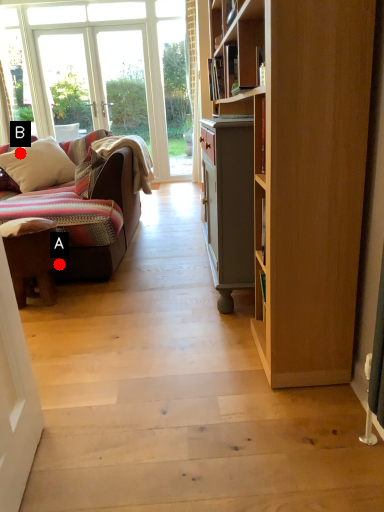
Question: Two points are circled on the image, labeled by A and B beside each circle. Which point appears farthest from the camera in this image?

Choices:
 (A) A is further
 (B) B is further

Answer: (B)